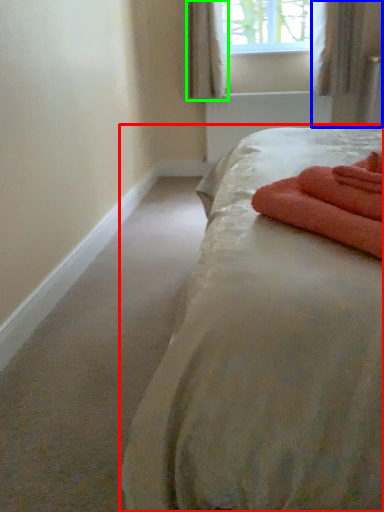
Question: Considering the real-world distances, which object is farthest from bed (highlighted by a red box)? curtain (highlighted by a blue box) or curtain (highlighted by a green box)?

Choices:
 (A) curtain
 (B) curtain

Answer: (B)